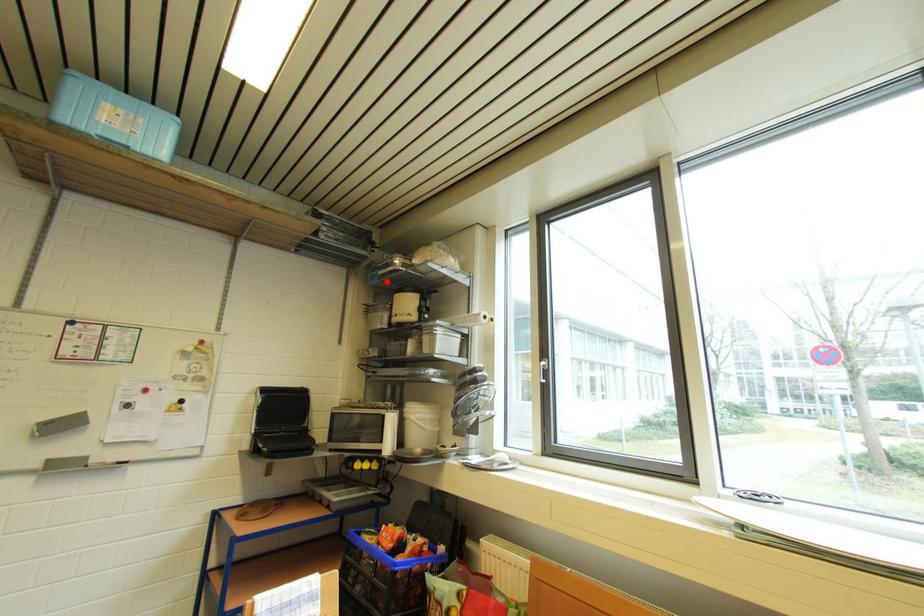
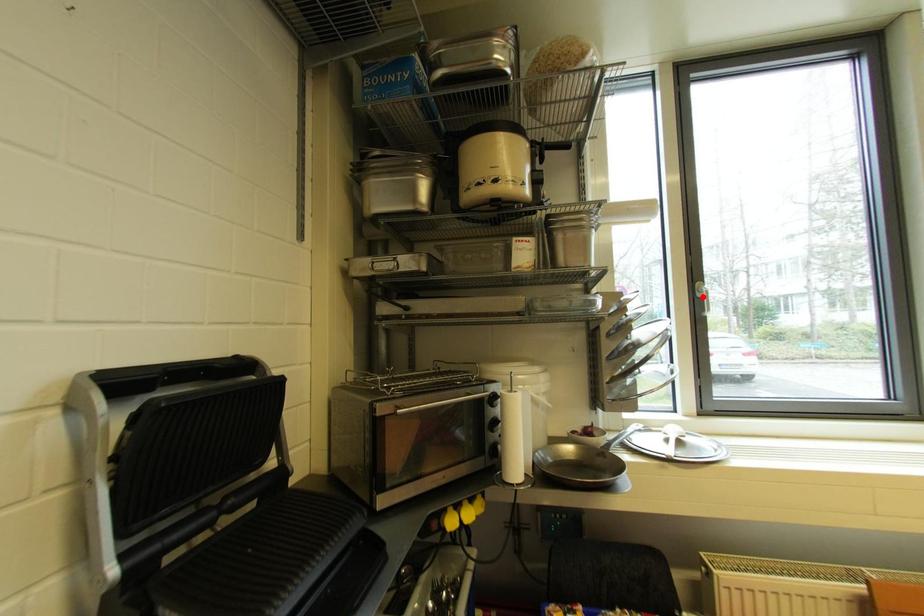
I am providing you with two images of the same scene from different viewpoints. A red point is marked on the first image and another point is marked on the second image. Is the marked point in image1 the same physical position as the marked point in image2?

No